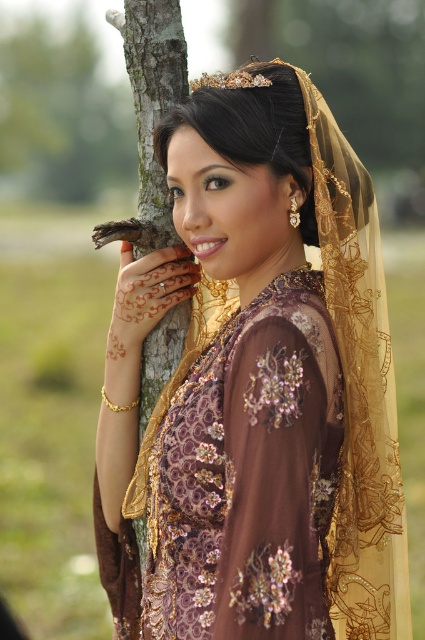
Question: Among these objects, which one is farthest from the camera?

Choices:
 (A) brown embroidered dress at center
 (B) matte gold headscarf at upper center

Answer: (B)

Question: Which point is closer to the camera taking this photo?

Choices:
 (A) (198, 550)
 (B) (241, 124)

Answer: (B)

Question: Does brown embroidered dress at center have a lesser width compared to matte gold headscarf at upper center?

Choices:
 (A) no
 (B) yes

Answer: (A)

Question: Does brown embroidered dress at center have a lesser width compared to matte gold headscarf at upper center?

Choices:
 (A) no
 (B) yes

Answer: (A)

Question: Is brown embroidered dress at center smaller than matte gold headscarf at upper center?

Choices:
 (A) yes
 (B) no

Answer: (B)